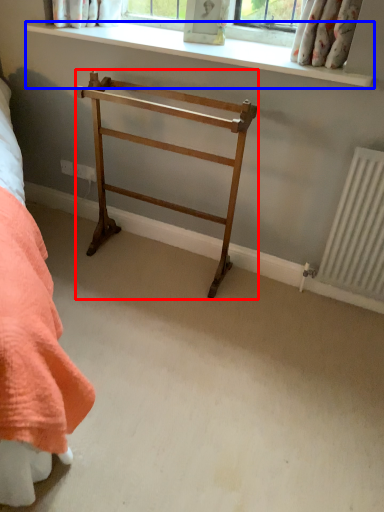
Question: Which object is further to the camera taking this photo, furniture (highlighted by a red box) or window sill (highlighted by a blue box)?

Choices:
 (A) furniture
 (B) window sill

Answer: (B)